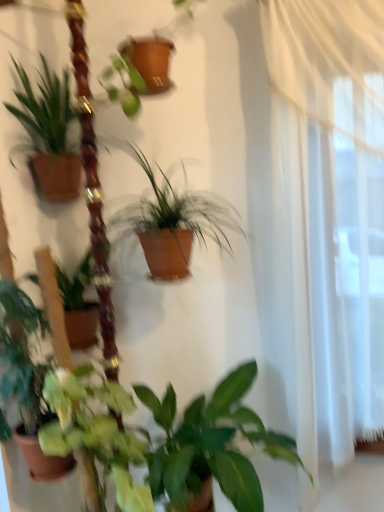
Question: Is point (104, 452) closer or farther from the camera than point (173, 409)?

Choices:
 (A) closer
 (B) farther

Answer: (A)

Question: From a real-world perspective, is green matte leafy plant at lower center above or below green matte plant at lower center, which appears as the 1th houseplant when ordered from the bottom?

Choices:
 (A) above
 (B) below

Answer: (A)

Question: Which of these objects is positioned closest to the green matte plant at lower center, which appears as the 1th houseplant when ordered from the bottom?

Choices:
 (A) green matte plant at left, the third houseplant from the top
 (B) brown matte pot at center, the 3th houseplant when ordered from bottom to top
 (C) green matte leafy plant at lower center
 (D) green matte plant at left, marked as the first houseplant in a top-to-bottom arrangement

Answer: (C)

Question: Which of these objects is positioned farthest from the green matte plant at left, which is the second houseplant in bottom-to-top order?

Choices:
 (A) green matte leafy plant at lower center
 (B) brown matte pot at center, the 3th houseplant when ordered from bottom to top
 (C) green matte plant at lower center, placed as the fourth houseplant when sorted from top to bottom
 (D) green matte plant at left, which is the 4th houseplant from bottom to top

Answer: (D)